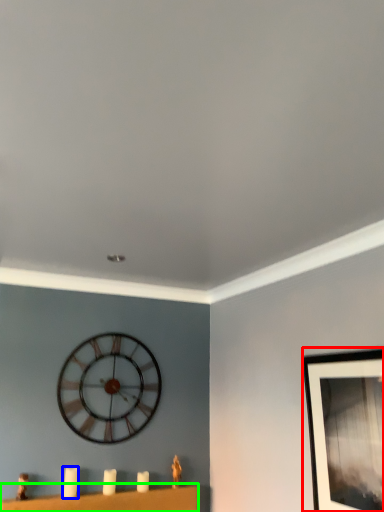
Question: Estimate the real-world distances between objects in this image. Which object is closer to picture frame (highlighted by a red box), candle (highlighted by a blue box) or furniture (highlighted by a green box)?

Choices:
 (A) candle
 (B) furniture

Answer: (B)